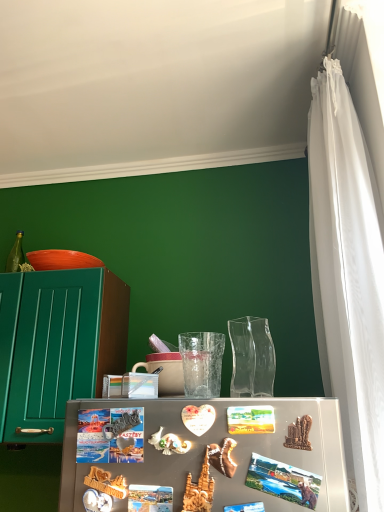
Question: From the image's perspective, is metallic photo magnet at center located above or below matte ceramic mug at center?

Choices:
 (A) above
 (B) below

Answer: (B)

Question: Is metallic photo magnet at center situated inside matte ceramic mug at center or outside?

Choices:
 (A) inside
 (B) outside

Answer: (B)

Question: Considering the real-world distances, which object is closest to the white sheer curtain at right?

Choices:
 (A) transparent textured glass at center
 (B) green matte cabinet at left
 (C) matte ceramic mug at center
 (D) orange matte bowl at upper left
 (E) transparent glass vase at center

Answer: (E)

Question: Based on their relative distances, which object is farther from the transparent textured glass at center?

Choices:
 (A) metallic photo magnet at center
 (B) white sheer curtain at right
 (C) matte ceramic mug at center
 (D) orange matte bowl at upper left
 (E) green matte cabinet at left

Answer: (D)